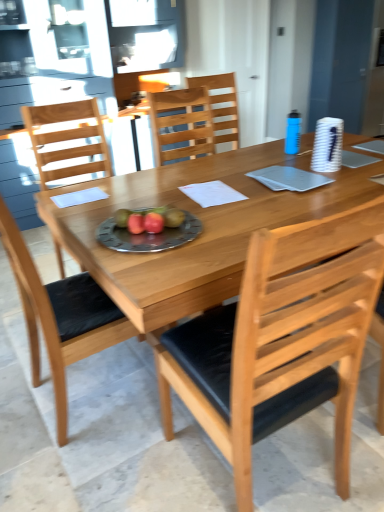
Locate an element on the screen. The width and height of the screenshot is (384, 512). free space on the front side of light brown wood chair at left, which appears as the second chair when viewed from the front is located at coordinates (93, 464).